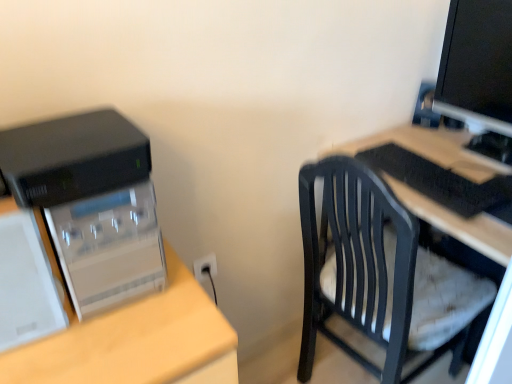
Question: Is the surface of black plastic chair at right in direct contact with black plastic computer tower at left?

Choices:
 (A) no
 (B) yes

Answer: (A)

Question: Is the depth of black plastic chair at right less than that of black plastic computer tower at left?

Choices:
 (A) yes
 (B) no

Answer: (B)

Question: Can you confirm if black plastic chair at right is thinner than black plastic computer tower at left?

Choices:
 (A) yes
 (B) no

Answer: (B)

Question: Is black plastic chair at right at the left side of black plastic computer tower at left?

Choices:
 (A) yes
 (B) no

Answer: (B)

Question: Is black plastic chair at right behind black plastic computer tower at left?

Choices:
 (A) yes
 (B) no

Answer: (A)

Question: Would you say black glossy monitor at upper right is inside or outside black plastic chair at right?

Choices:
 (A) inside
 (B) outside

Answer: (B)

Question: From a real-world perspective, is black glossy monitor at upper right above or below black plastic chair at right?

Choices:
 (A) above
 (B) below

Answer: (A)

Question: In terms of width, does black glossy monitor at upper right look wider or thinner when compared to black plastic chair at right?

Choices:
 (A) wide
 (B) thin

Answer: (B)

Question: In terms of height, does black glossy monitor at upper right look taller or shorter compared to black plastic chair at right?

Choices:
 (A) short
 (B) tall

Answer: (A)

Question: From their relative heights in the image, would you say black plastic computer tower at left is taller or shorter than black plastic keyboard at right?

Choices:
 (A) short
 (B) tall

Answer: (B)

Question: Would you say black plastic computer tower at left is inside or outside black plastic keyboard at right?

Choices:
 (A) outside
 (B) inside

Answer: (A)

Question: Considering the relative positions of black plastic computer tower at left and black plastic keyboard at right in the image provided, is black plastic computer tower at left to the left or to the right of black plastic keyboard at right?

Choices:
 (A) left
 (B) right

Answer: (A)

Question: From a real-world perspective, relative to black plastic keyboard at right, is black plastic computer tower at left vertically above or below?

Choices:
 (A) above
 (B) below

Answer: (A)

Question: Is black plastic chair at right in front of or behind black plastic keyboard at right in the image?

Choices:
 (A) behind
 (B) front

Answer: (B)

Question: From the image's perspective, is black plastic chair at right positioned above or below black plastic keyboard at right?

Choices:
 (A) below
 (B) above

Answer: (A)